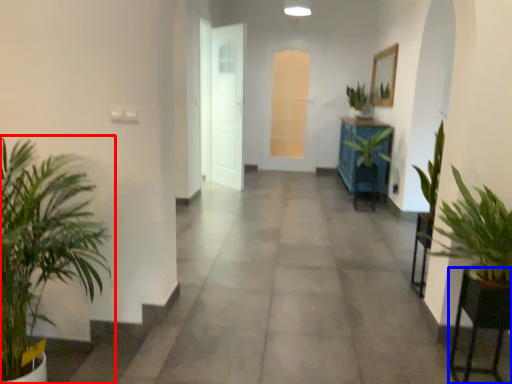
Question: Which of the following is the closest to the observer, houseplant (highlighted by a red box) or furniture (highlighted by a blue box)?

Choices:
 (A) houseplant
 (B) furniture

Answer: (A)